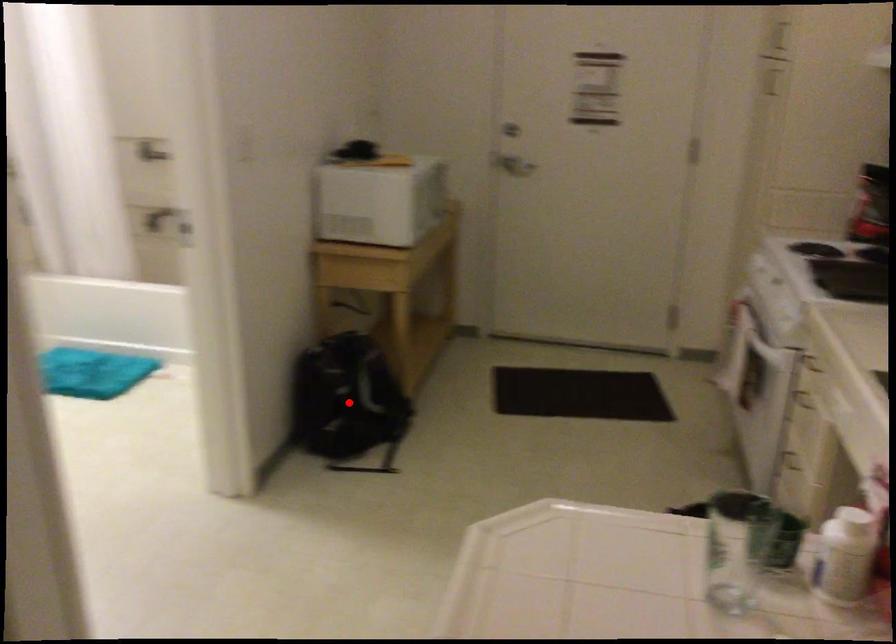
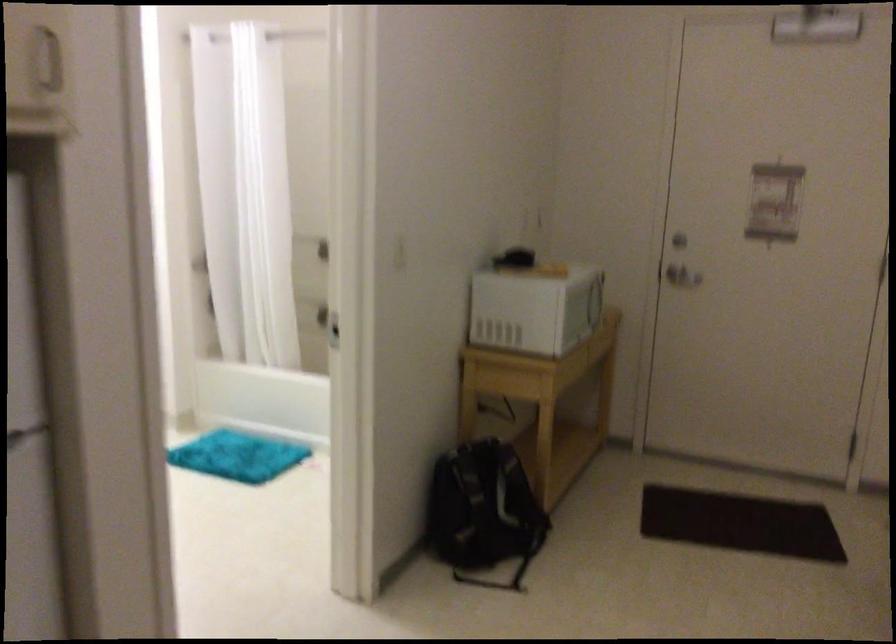
The point at the highlighted location is marked in the first image. Where is the corresponding point in the second image?

(483, 512)